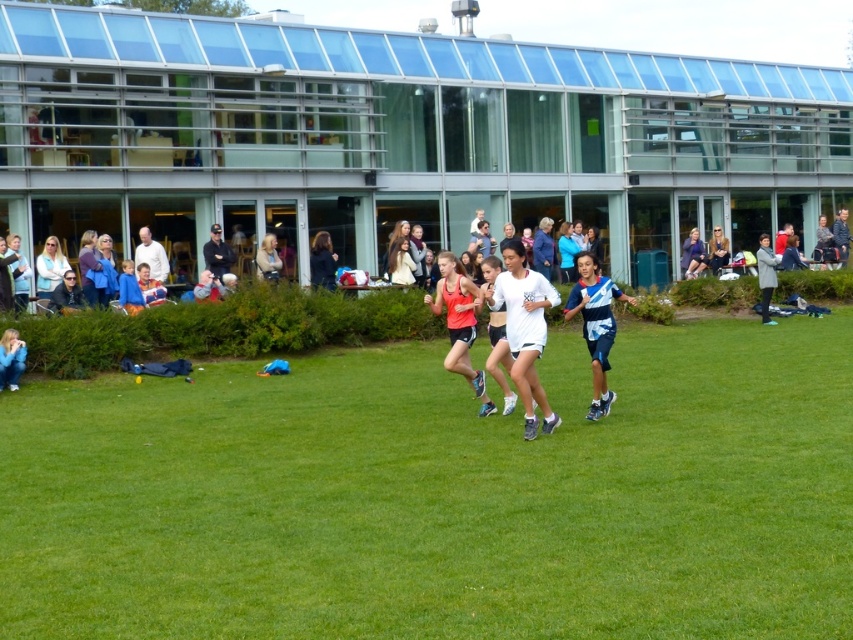
You are an athlete participating in a race on a grassy field. You see a dark blue jacket at center. Where is the dark blue jacket located in terms of coordinates?

The dark blue jacket at center is located at point coordinates of (322, 260).

You are a photographer at the edge of the field. You notice two jackets left at the center of the field. The jackets are the dark blue jacket at center and the blue denim jacket at center. Which jacket is closer to the ground?

The dark blue jacket at center is closer to the ground because it is below the blue denim jacket at center.